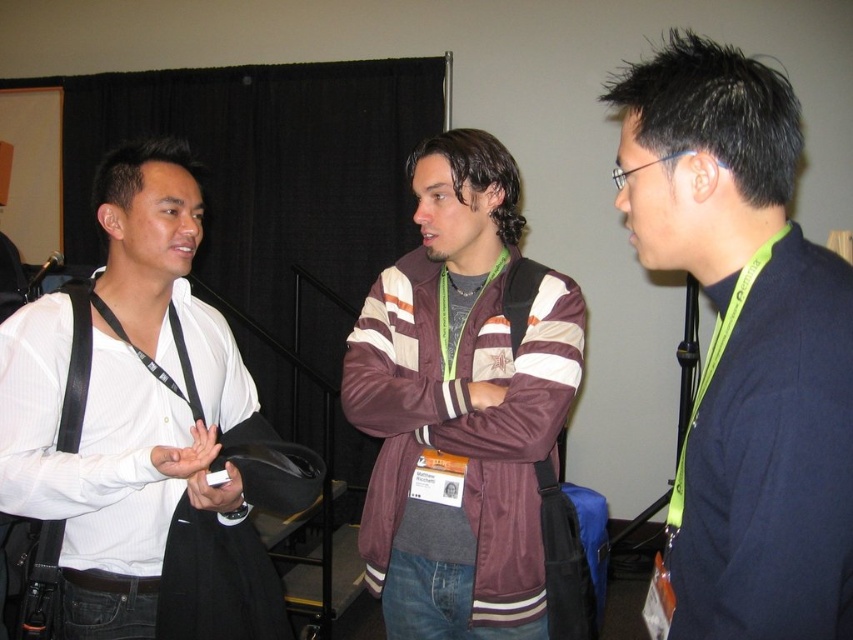
You are standing in the room and want to reach a point that is 28.91 inches away from you. Is the point at coordinate point(746, 515) within that distance?

The point at coordinate point(746, 515) is exactly 28.91 inches away from the viewer, so yes, it is within that distance.

You are standing in the room and want to hand a document to both the maroon fabric jacket at center and the white shirt at left. Which person should you approach first to ensure you can reach them without moving around the other?

You should approach the maroon fabric jacket at center first because it is closer to you than the white shirt at left, so you can reach them without needing to move around the other person.